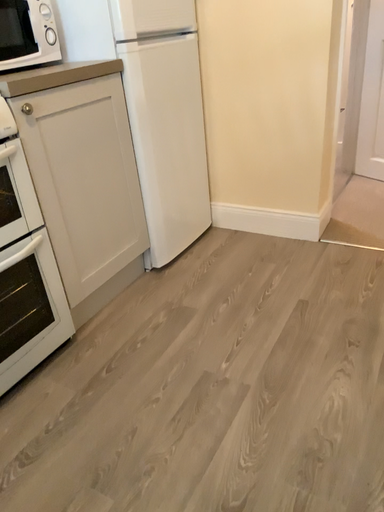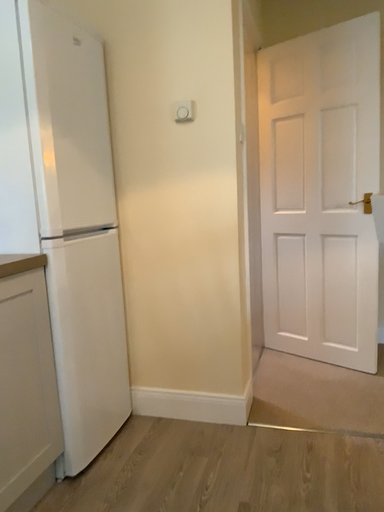
Question: Which way did the camera rotate in the video?

Choices:
 (A) rotated right
 (B) rotated left

Answer: (A)